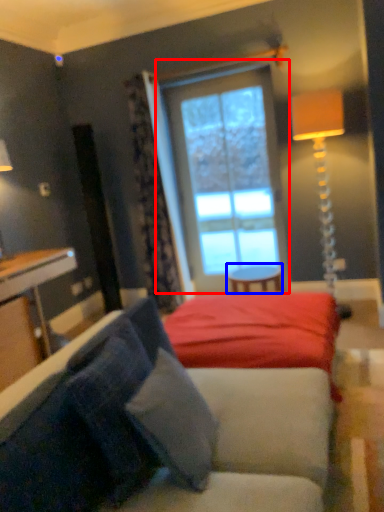
Question: Which of the following is the farthest to the observer, window (highlighted by a red box) or table (highlighted by a blue box)?

Choices:
 (A) window
 (B) table

Answer: (A)